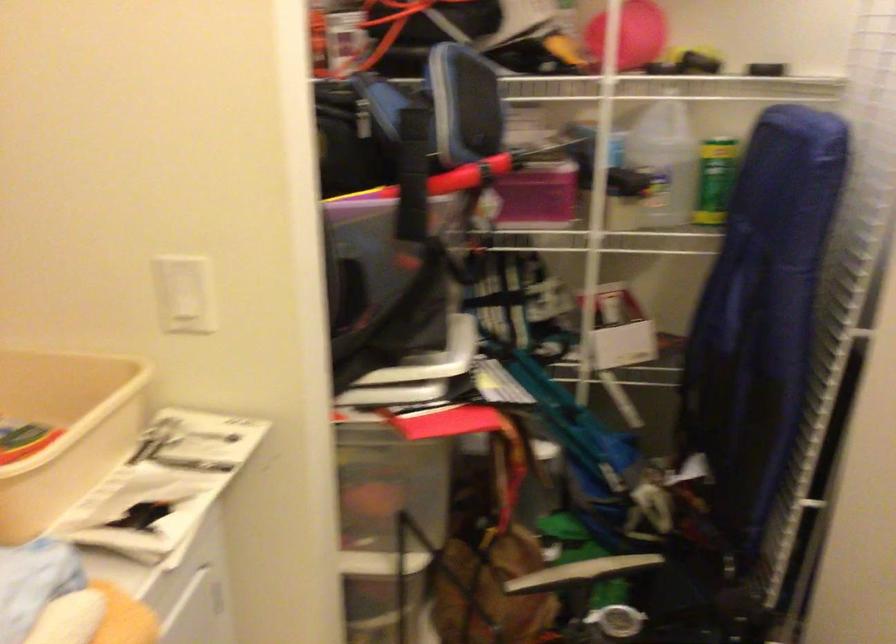
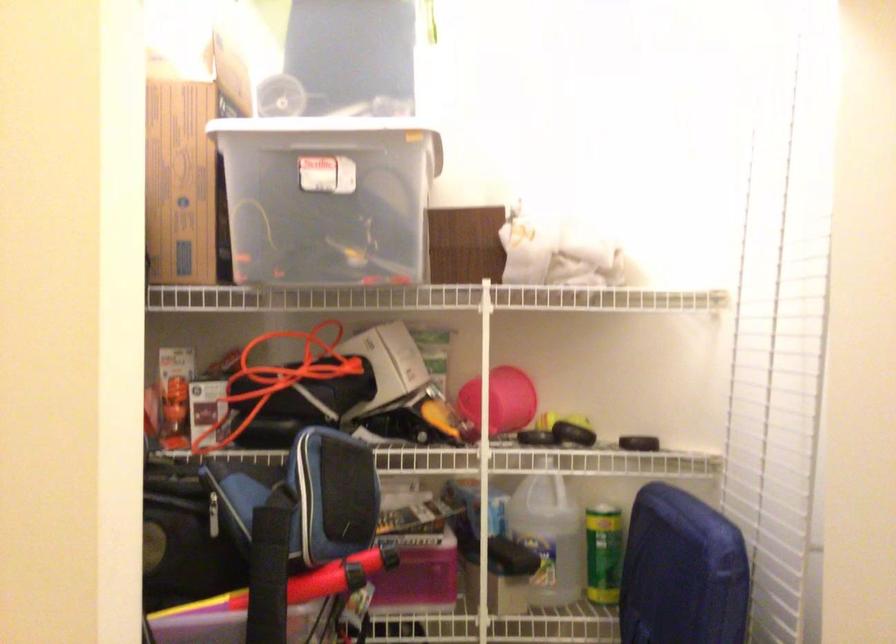
Question: I am providing you with two images of the same scene from different viewpoints. After the viewpoint changes to image2, which objects are now occluded?

Choices:
 (A) red tool handle
 (B) black fabric strap
 (C) pink storage container
 (D) none of these

Answer: (D)